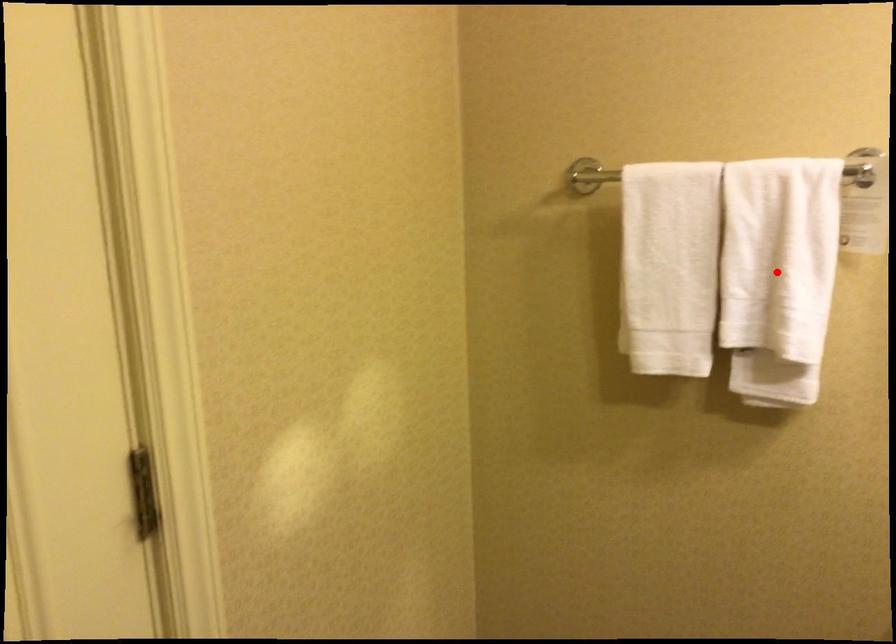
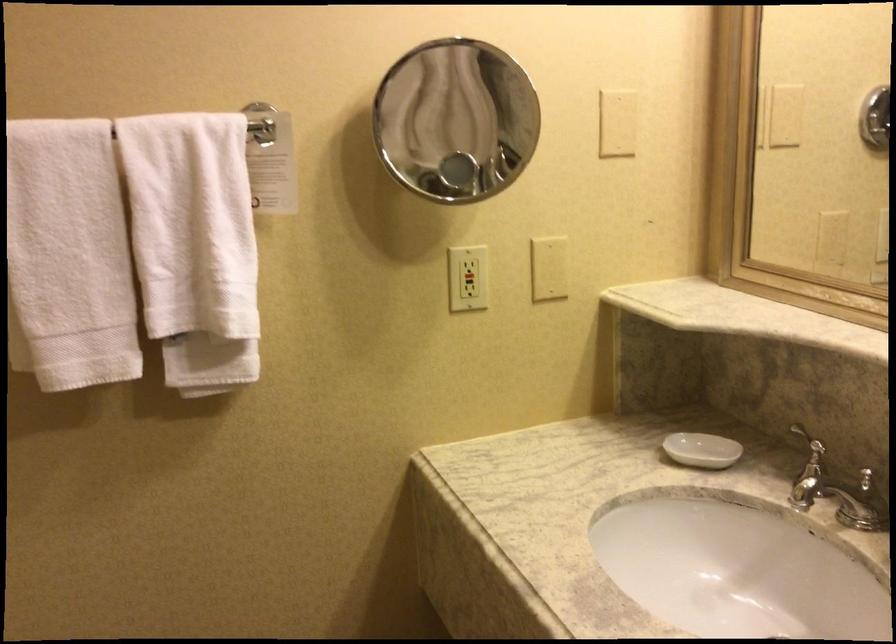
The point at the highlighted location is marked in the first image. Where is the corresponding point in the second image?

(194, 245)